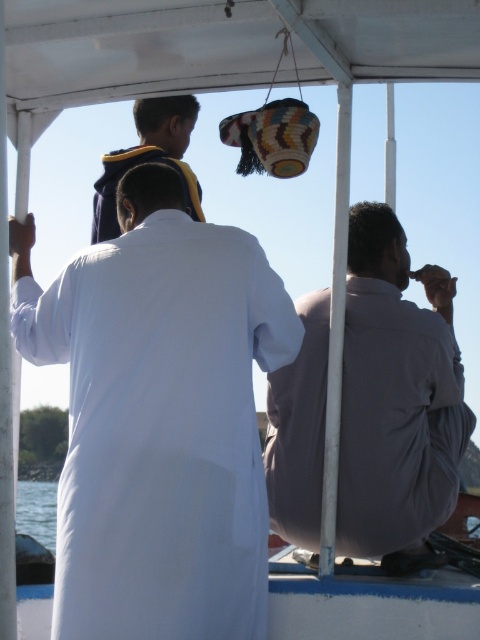
Does gray cotton shirt at right have a smaller size compared to clear blue water at lower left?

Yes.

Does gray cotton shirt at right have a greater height compared to clear blue water at lower left?

Yes, gray cotton shirt at right is taller than clear blue water at lower left.

Is point (354, 266) positioned before point (48, 534)?

Yes, it is.

Locate an element on the screen. This screenshot has height=640, width=480. gray cotton shirt at right is located at coordinates (396, 394).

Is dark blue hoodie at upper left smaller than clear blue water at lower left?

Correct, dark blue hoodie at upper left occupies less space than clear blue water at lower left.

Does point (168, 104) lie behind point (36, 500)?

No, (168, 104) is in front of (36, 500).

In order to click on dark blue hoodie at upper left in this screenshot , I will do `click(148, 157)`.

Is gray cotton shirt at right smaller than dark blue hoodie at upper left?

No, gray cotton shirt at right is not smaller than dark blue hoodie at upper left.

Is gray cotton shirt at right thinner than dark blue hoodie at upper left?

No.

Find the location of a particular element. gray cotton shirt at right is located at coordinates pos(396,394).